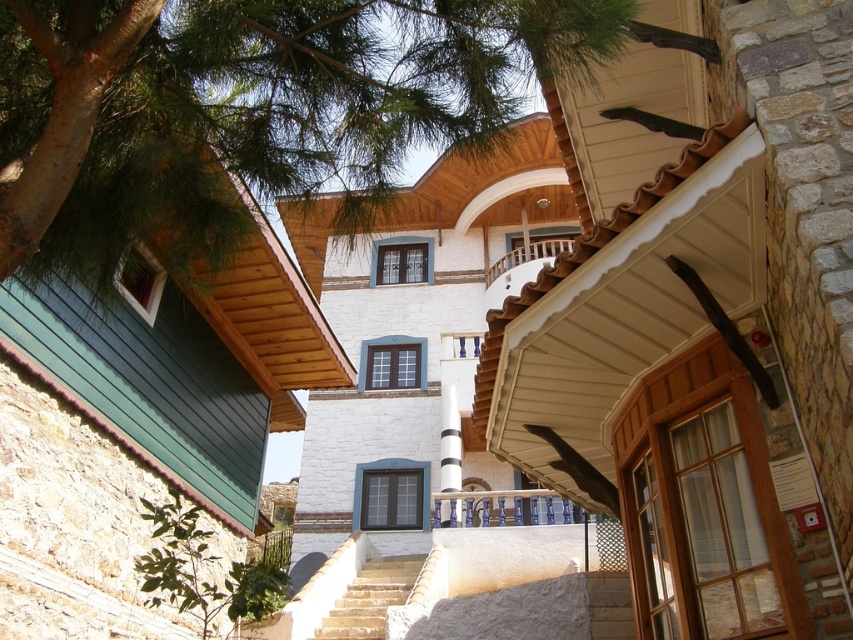
Does green leafy tree at upper left appear on the right side of white glossy balustrade at center?

In fact, green leafy tree at upper left is to the left of white glossy balustrade at center.

This screenshot has height=640, width=853. Describe the element at coordinates (248, 109) in the screenshot. I see `green leafy tree at upper left` at that location.

Which is behind, point (4, 58) or point (548, 496)?

Point (548, 496)

In order to click on green leafy tree at upper left in this screenshot , I will do `click(248, 109)`.

Can you confirm if green leafy tree at upper left is positioned to the right of light beige stone stairs at lower center?

In fact, green leafy tree at upper left is to the left of light beige stone stairs at lower center.

Who is positioned more to the left, green leafy tree at upper left or light beige stone stairs at lower center?

From the viewer's perspective, green leafy tree at upper left appears more on the left side.

Describe the element at coordinates (248, 109) in the screenshot. I see `green leafy tree at upper left` at that location.

Identify the location of green leafy tree at upper left. click(248, 109).

Does light beige stone stairs at lower center have a greater height compared to white glossy balustrade at center?

Yes, light beige stone stairs at lower center is taller than white glossy balustrade at center.

Who is more distant from viewer, (x=405, y=595) or (x=448, y=524)?

Point (x=448, y=524)

Is point (405, 577) behind point (561, 515)?

No.

You are a GUI agent. You are given a task and a screenshot of the screen. Output one action in this format:
    pyautogui.click(x=<x>, y=<y>)
    Task: Click on the light beige stone stairs at lower center
    This screenshot has height=640, width=853.
    Given the screenshot: What is the action you would take?
    370,596